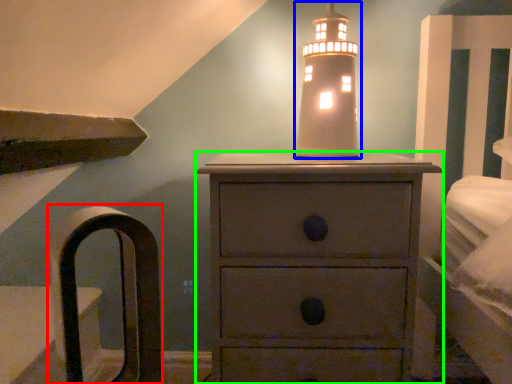
Question: Which object is the closest to the armchair (highlighted by a red box)? Choose among these: candle holder (highlighted by a blue box) or chest of drawers (highlighted by a green box).

Choices:
 (A) candle holder
 (B) chest of drawers

Answer: (B)